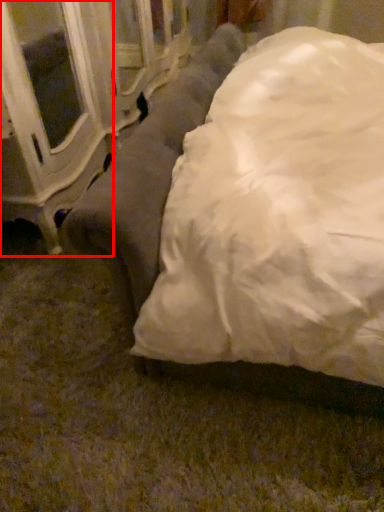
Question: In this image, where is furniture (annotated by the red box) located relative to studio couch?

Choices:
 (A) left
 (B) right

Answer: (A)